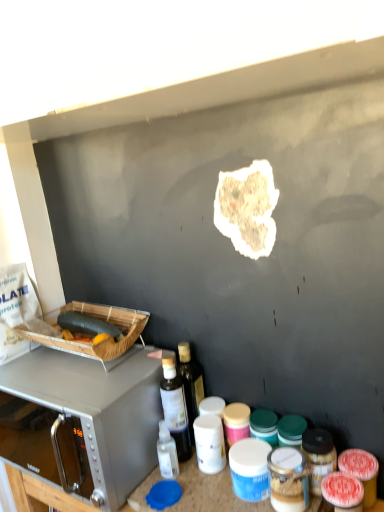
Question: In terms of width, does matte plastic container at center, which is the second appliance from top to bottom, look wider or thinner when compared to green matte zucchini at left, marked as the 2th food in a top-to-bottom arrangement?

Choices:
 (A) wide
 (B) thin

Answer: (A)

Question: Based on their positions, is matte plastic container at center, which is the 1th appliance from bottom to top, located to the left or right of green matte zucchini at left, which is the second food from right to left?

Choices:
 (A) left
 (B) right

Answer: (B)

Question: Considering the real-world distances, which object is closest to the green matte zucchini at left, which is the second food from right to left?

Choices:
 (A) brown crumbly bread at center, which ranks as the 1th food in top-to-bottom order
 (B) wooden crate at left, which is the first appliance from back to front
 (C) matte plastic container at center, the 1th appliance from the right
 (D) satin silver microwave at upper left
 (E) translucent plastic bottle at center

Answer: (B)

Question: Which of these objects is positioned closest to the brown crumbly bread at center, arranged as the 2th food when viewed from the left?

Choices:
 (A) satin silver microwave at upper left
 (B) translucent plastic bottle at center
 (C) matte plastic container at center, which is the second appliance from top to bottom
 (D) wooden crate at left, the second appliance positioned from the right
 (E) green matte zucchini at left, which ranks as the 1th food in back-to-front order

Answer: (B)